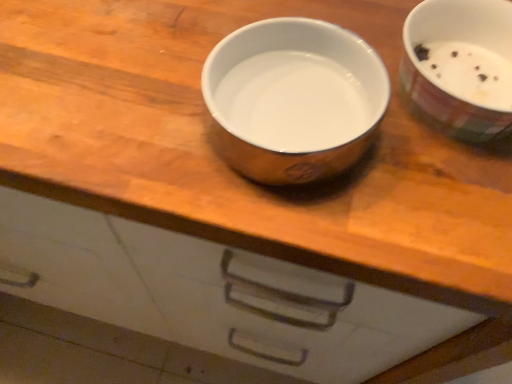
Locate an element on the screen. This screenshot has width=512, height=384. vacant area on the back side of satin silver bowl at center, which is the 2th tableware in right-to-left order is located at coordinates (283, 16).